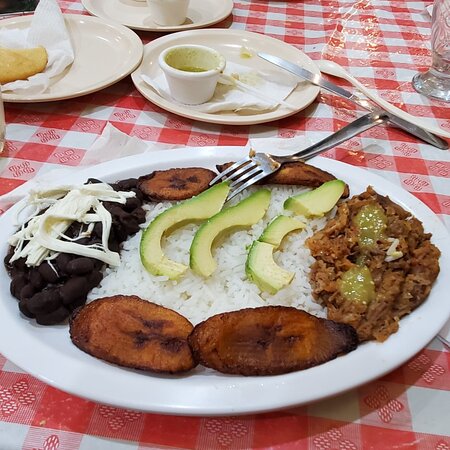
You are a GUI agent. You are given a task and a screenshot of the screen. Output one action in this format:
    pyautogui.click(x=<x>, y=<y>)
    Task: Click on the utensil
    This screenshot has height=450, width=450.
    Given the screenshot: What is the action you would take?
    pyautogui.click(x=312, y=149), pyautogui.click(x=399, y=122), pyautogui.click(x=388, y=105)